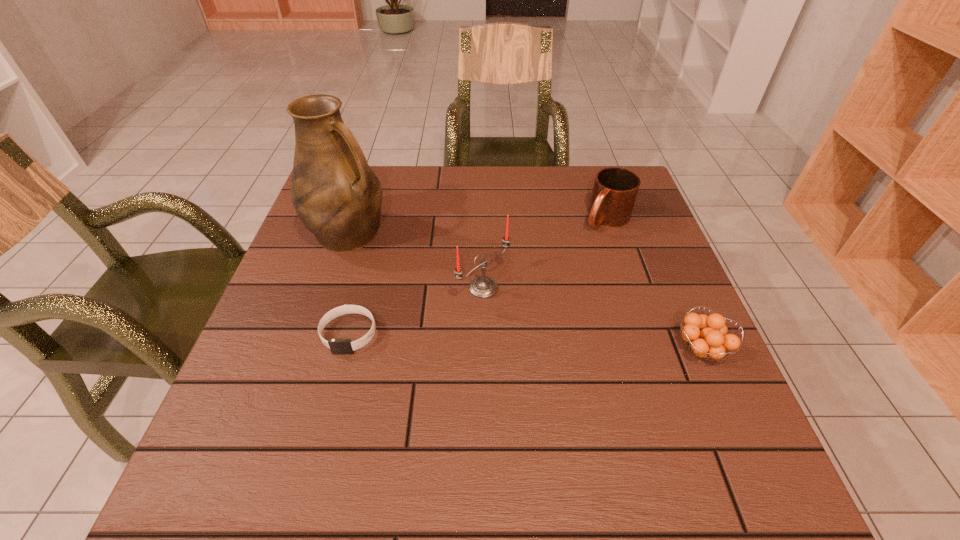
I want to click on free region at the far right corner, so click(x=589, y=173).

Where is `free space that is in between the second shortest object and the shortest object`? Image resolution: width=960 pixels, height=540 pixels. free space that is in between the second shortest object and the shortest object is located at coordinates (525, 342).

What are the coordinates of `free spot between the orange fruit and the tallest object` in the screenshot? It's located at (525, 291).

At what (x,y) coordinates should I click in order to perform the action: click on blank region between the pitcher and the second tallest object. Please return your answer as a coordinate pair (x, y). Looking at the image, I should click on (416, 260).

Identify the location of free area in between the third tallest object and the shortest object. Image resolution: width=960 pixels, height=540 pixels. (478, 276).

Find the location of a particular element. free space between the mug and the tallest object is located at coordinates (478, 226).

You are a GUI agent. You are given a task and a screenshot of the screen. Output one action in this format:
    pyautogui.click(x=<x>, y=<y>)
    Task: Click on the free area in between the tallest object and the shortest object
    The image size is (960, 540).
    Given the screenshot: What is the action you would take?
    pyautogui.click(x=349, y=283)

Find the location of a particular element. empty location between the third tallest object and the tallest object is located at coordinates (478, 226).

Identify the location of free point between the shortest object and the third nearest object. Image resolution: width=960 pixels, height=540 pixels. (417, 310).

You are a GUI agent. You are given a task and a screenshot of the screen. Output one action in this format:
    pyautogui.click(x=<x>, y=<y>)
    Task: Click on the free space that is in between the third tallest object and the second shortest object
    This screenshot has height=540, width=960.
    Given the screenshot: What is the action you would take?
    pyautogui.click(x=654, y=284)